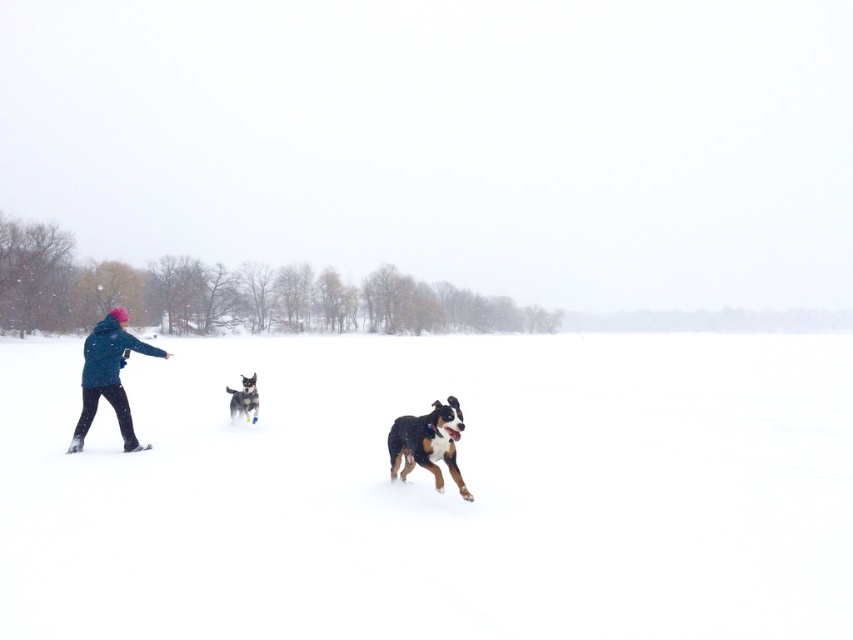
You are planning to build a snowman using the white fluffy snow at center and wearing the blue fleece jacket at left. Which material would you use for the base of the snowman and why?

The white fluffy snow at center is bigger than the blue fleece jacket at left, so you should use the white fluffy snow at center for the base of the snowman because it provides a larger and more stable foundation.

You are a photographer trying to capture the scene. You notice the blue fleece jacket at left and the brown and white fur dog at center. Which object is shorter in height?

The blue fleece jacket at left is not as tall as the brown and white fur dog at center, so the blue fleece jacket at left is shorter in height.